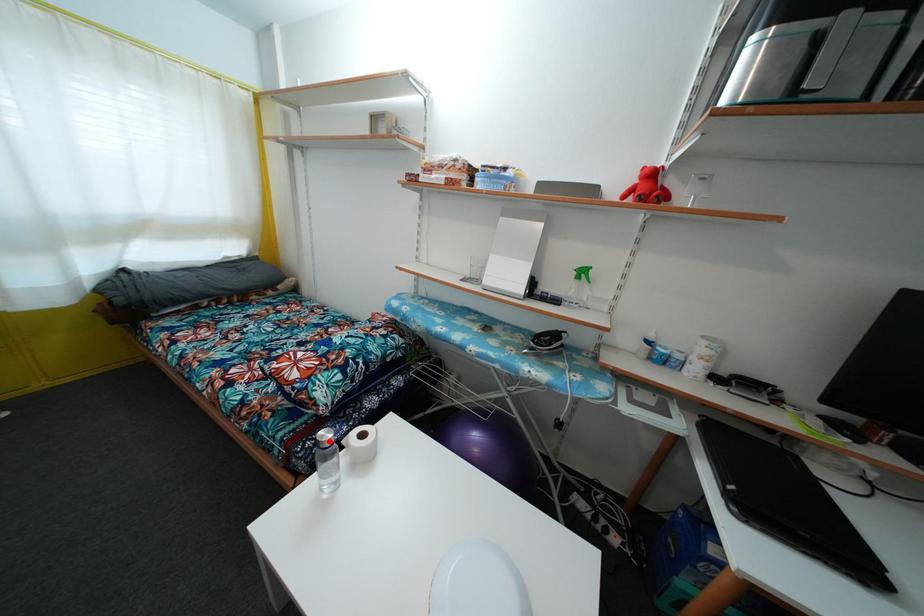
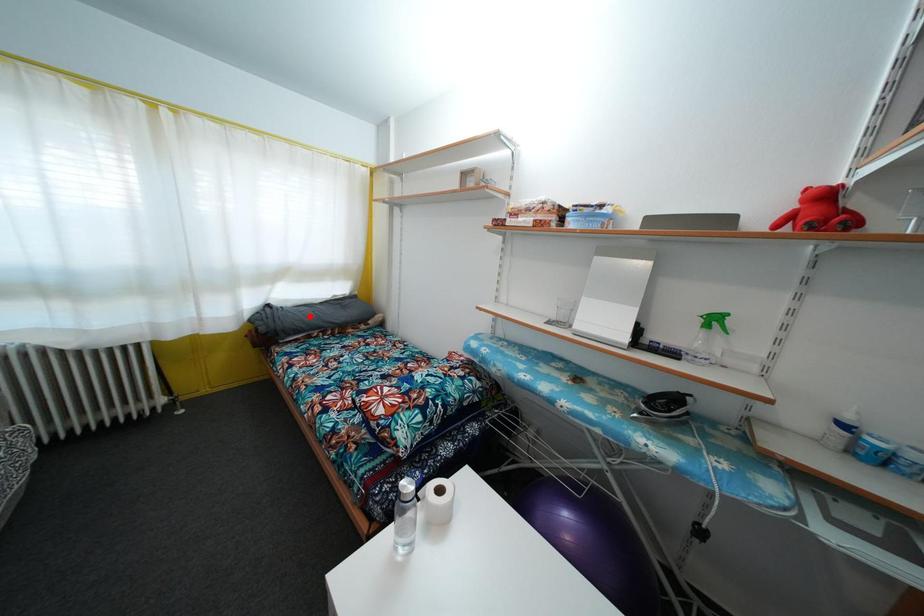
I am providing you with two images of the same scene from different viewpoints. A red point is marked on the first image and another point is marked on the second image. Is the marked point in image1 the same physical position as the marked point in image2?

No